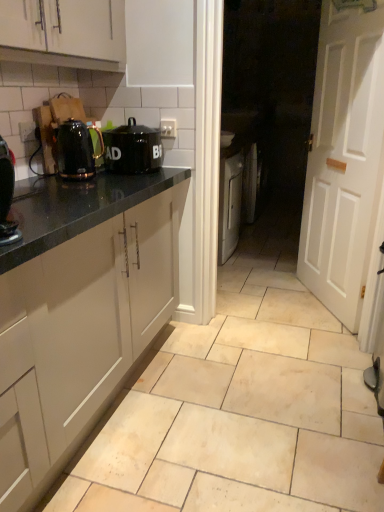
The image size is (384, 512). In order to click on free space behind white wooden door at right in this screenshot , I will do `click(274, 274)`.